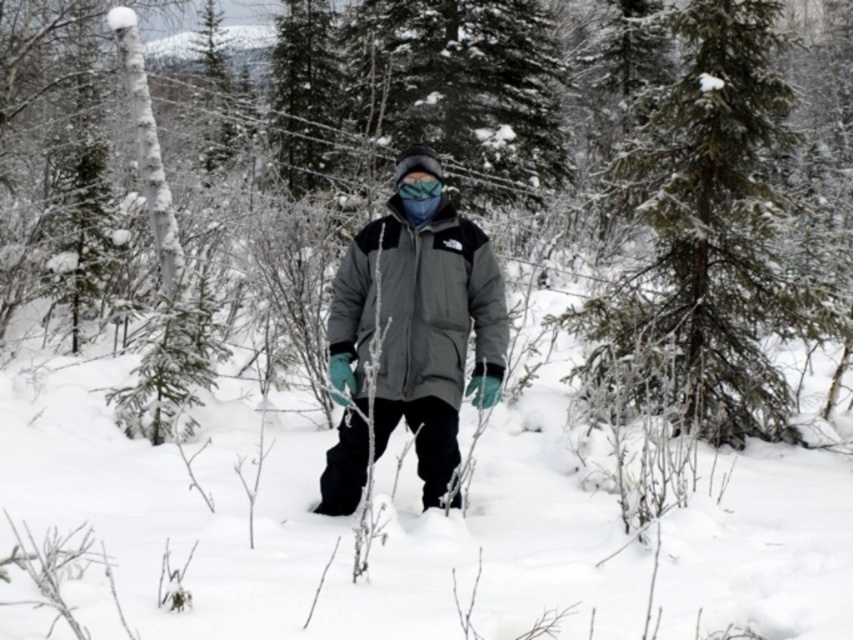
Question: In this image, where is green textured pine tree at upper right located relative to gray matte jacket at center?

Choices:
 (A) left
 (B) right

Answer: (B)

Question: Which object is closer to the camera taking this photo?

Choices:
 (A) blue fabric goggles at center
 (B) green textured pine tree at upper right
 (C) gray matte jacket at center

Answer: (C)

Question: Is green textured pine tree at upper right thinner than gray matte jacket at center?

Choices:
 (A) no
 (B) yes

Answer: (B)

Question: Does green textured pine tree at upper right have a lesser width compared to blue fabric goggles at center?

Choices:
 (A) yes
 (B) no

Answer: (B)

Question: Which point is farther from the camera taking this photo?

Choices:
 (A) (440, 477)
 (B) (735, 113)

Answer: (B)

Question: Which point is farther to the camera?

Choices:
 (A) (331, 374)
 (B) (740, 60)

Answer: (B)